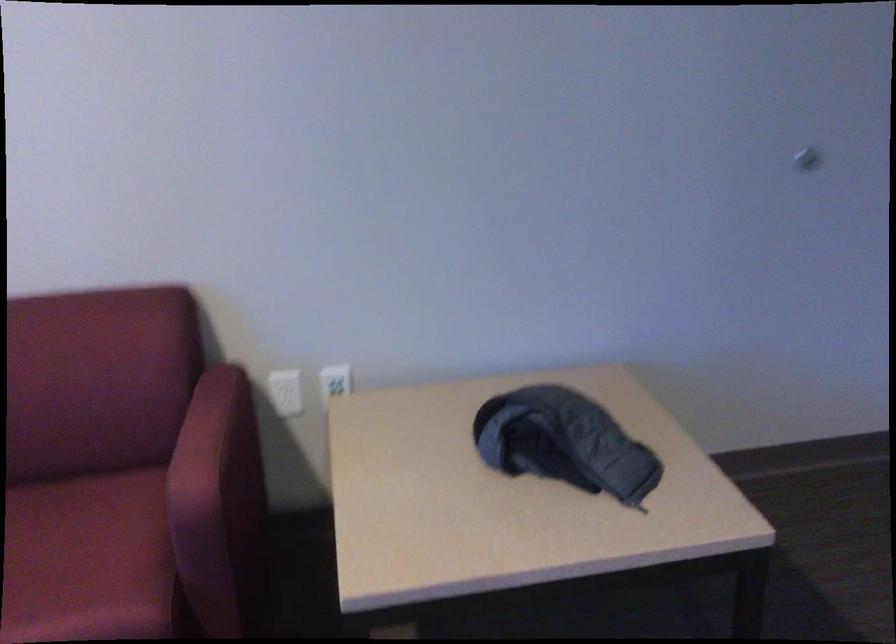
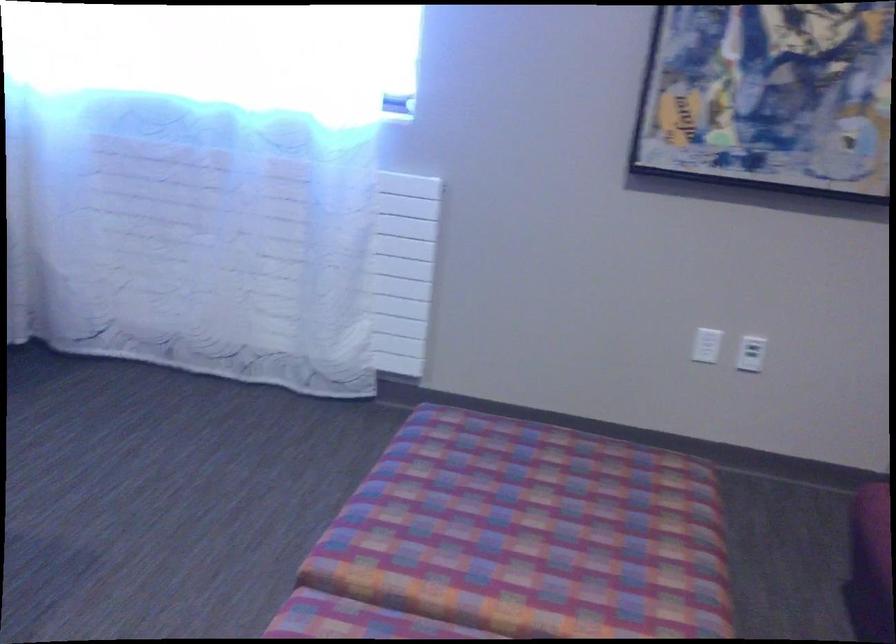
Consider the image. How did the camera likely rotate?

The camera rotated toward left-down.